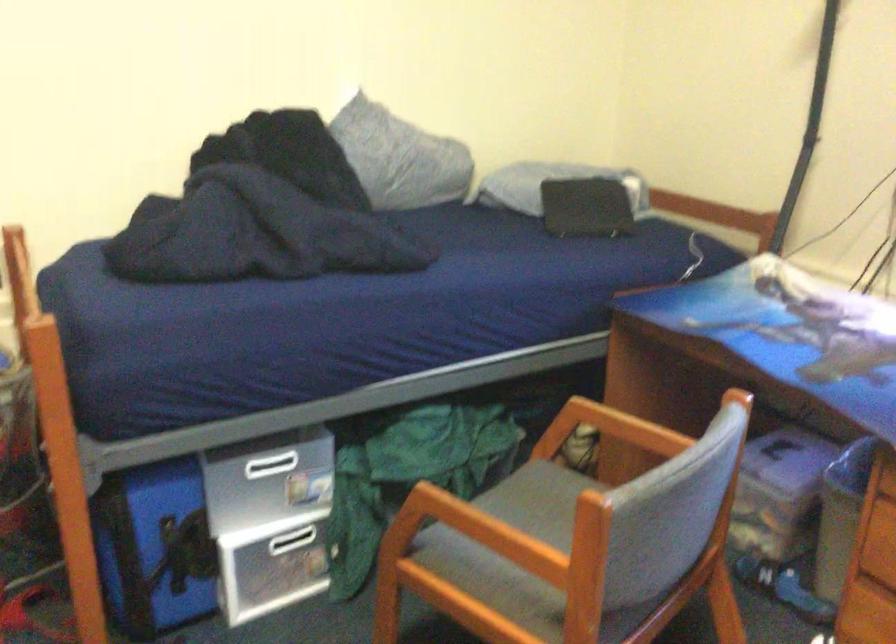
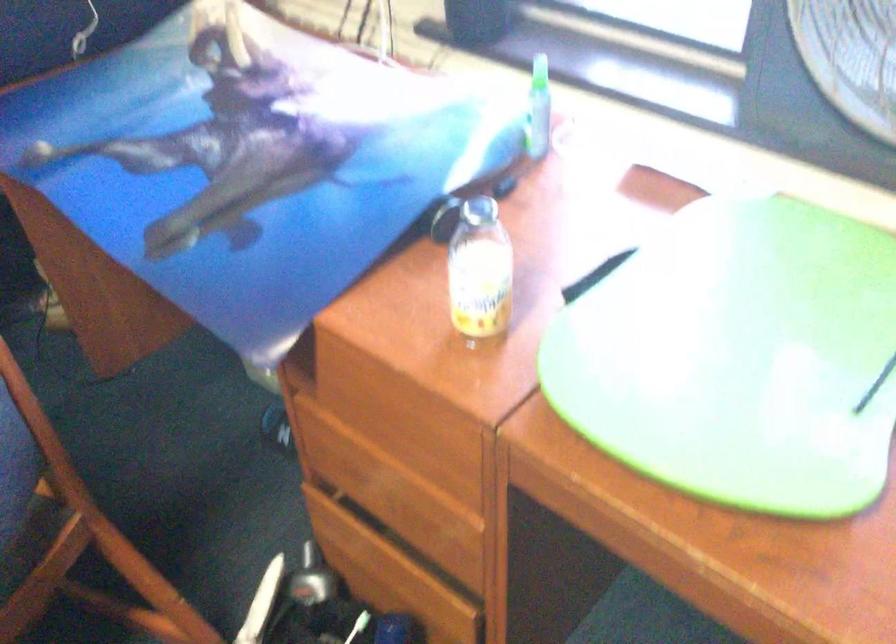
Which direction would the cameraman need to move to produce the second image?

The cameraman moved toward right, forward.